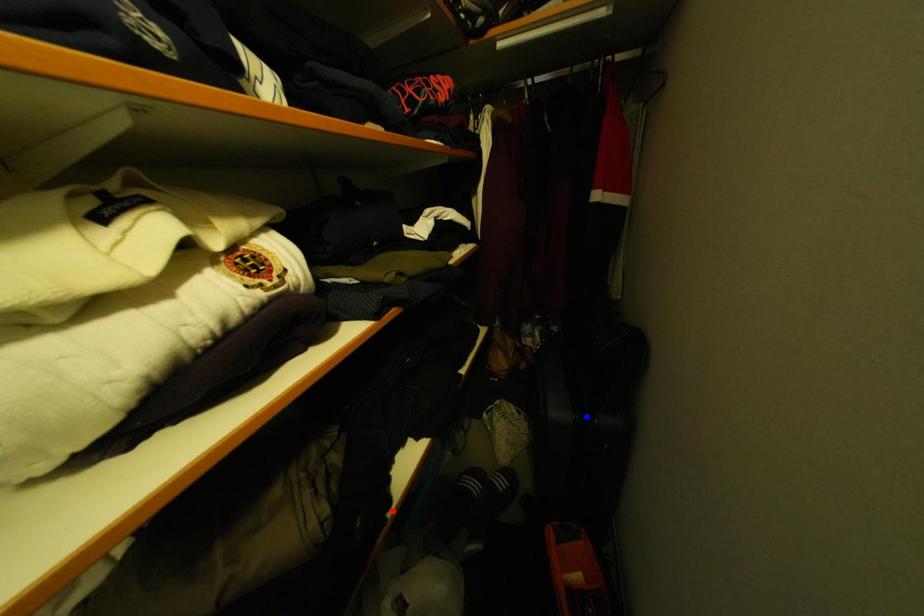
Question: Which of the two points in the image is closer to the camera?

Choices:
 (A) Blue point is closer.
 (B) Red point is closer.

Answer: (B)